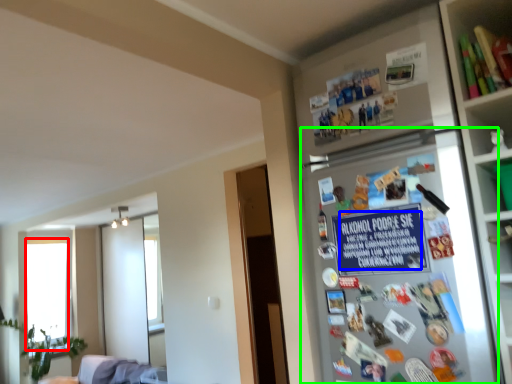
Question: Which object is positioned farthest from window screen (highlighted by a red box)? Select from writing (highlighted by a blue box) and fridge (highlighted by a green box).

Choices:
 (A) writing
 (B) fridge

Answer: (A)